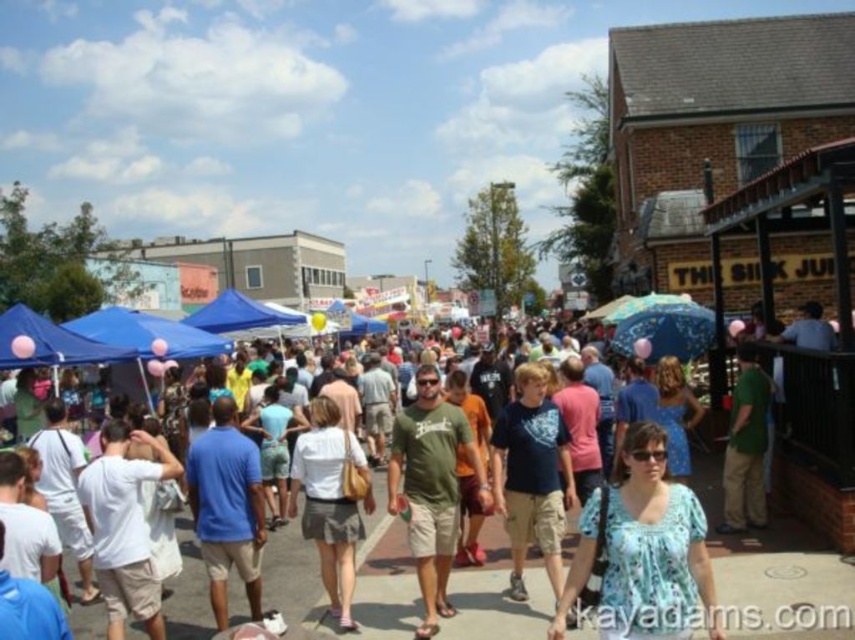
Question: Based on their relative distances, which object is nearer to the white fabric skirt at center?

Choices:
 (A) white cotton shirts at center
 (B) blue floral blouse at center

Answer: (A)

Question: Based on their relative distances, which object is farther from the white cotton shirts at center?

Choices:
 (A) white fabric skirt at center
 (B) blue floral blouse at center
 (C) green cotton t-shirt at center

Answer: (A)

Question: Is white cotton shirts at center positioned at the back of white fabric skirt at center?

Choices:
 (A) yes
 (B) no

Answer: (B)

Question: Is white cotton shirts at center smaller than green cotton t-shirt at center?

Choices:
 (A) no
 (B) yes

Answer: (A)

Question: Is white cotton shirts at center below green cotton t-shirt at center?

Choices:
 (A) yes
 (B) no

Answer: (A)

Question: Which of the following is the farthest from the observer?

Choices:
 (A) white fabric skirt at center
 (B) white cotton shirts at center

Answer: (A)